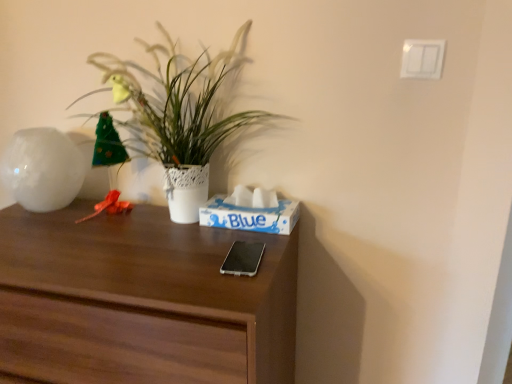
This screenshot has height=384, width=512. I want to click on vacant space in front of white lace pot at upper left, so click(x=149, y=256).